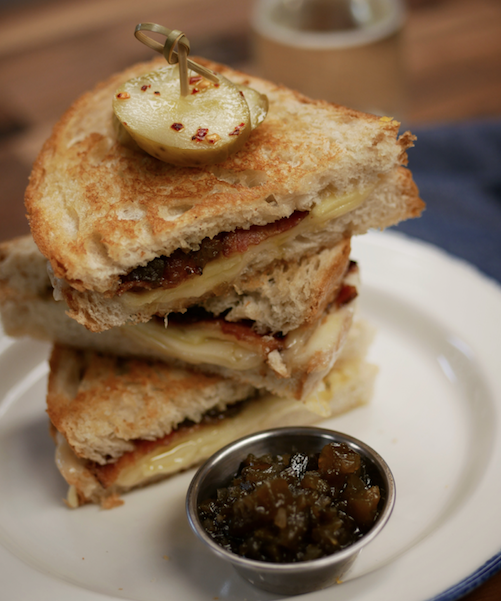
You are a GUI agent. You are given a task and a screenshot of the screen. Output one action in this format:
    pyautogui.click(x=<x>, y=<y>)
    Task: Click on the cup
    This screenshot has height=601, width=501.
    Given the screenshot: What is the action you would take?
    pyautogui.click(x=361, y=82)